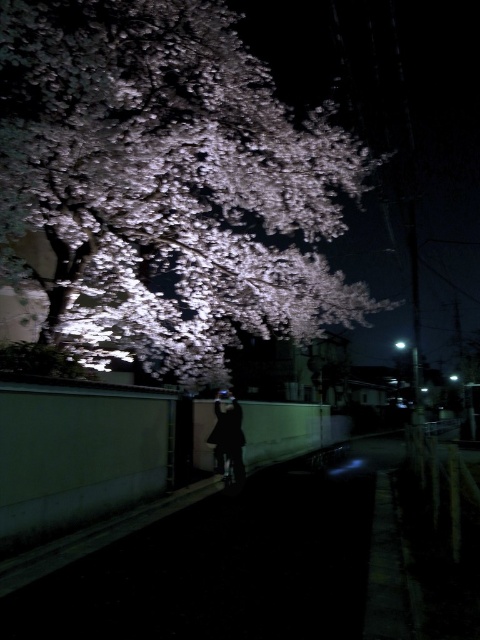
Question: Can you confirm if white blossoms at upper left is thinner than black matte coat at center?

Choices:
 (A) yes
 (B) no

Answer: (B)

Question: Is white blossoms at upper left positioned behind black matte coat at center?

Choices:
 (A) yes
 (B) no

Answer: (B)

Question: Which object appears farthest from the camera in this image?

Choices:
 (A) white blossoms at upper left
 (B) black matte coat at center

Answer: (B)

Question: Which point is farther to the camera?

Choices:
 (A) white blossoms at upper left
 (B) black matte coat at center

Answer: (B)

Question: Which point is closer to the camera taking this photo?

Choices:
 (A) (57, 145)
 (B) (236, 401)

Answer: (A)

Question: Is white blossoms at upper left positioned in front of black matte coat at center?

Choices:
 (A) yes
 (B) no

Answer: (A)